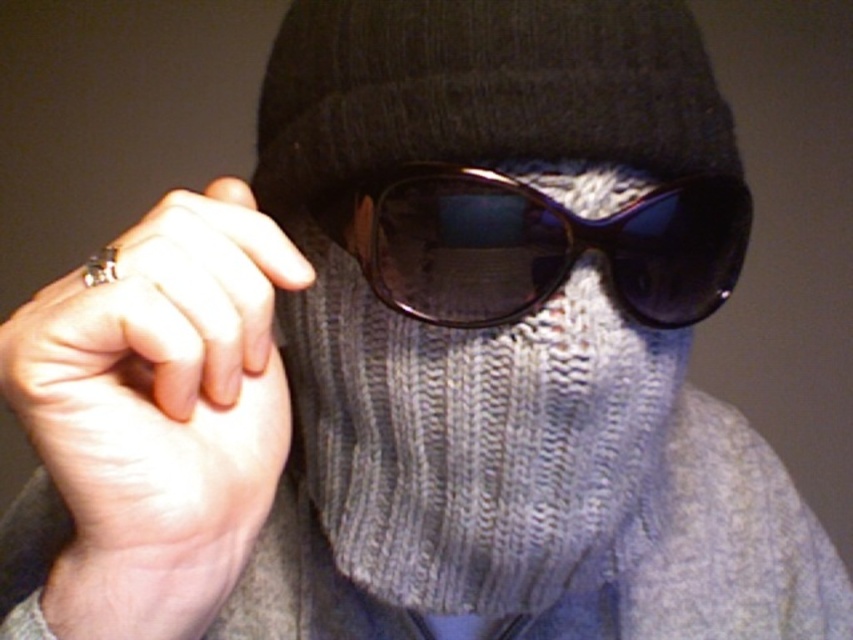
Can you confirm if silver metallic ring at left is taller than sunglasses at center?

Correct, silver metallic ring at left is much taller as sunglasses at center.

Does point (166, 225) come farther from viewer compared to point (669, 202)?

No, it is in front of (669, 202).

Which is in front, point (239, 544) or point (357, 259)?

Point (239, 544) is in front.

This screenshot has width=853, height=640. In order to click on silver metallic ring at left in this screenshot , I will do pyautogui.click(x=161, y=381).

You are a GUI agent. You are given a task and a screenshot of the screen. Output one action in this format:
    pyautogui.click(x=<x>, y=<y>)
    Task: Click on the knitted gray scarf at center
    The image size is (853, 640).
    Given the screenshot: What is the action you would take?
    pyautogui.click(x=474, y=436)

Does point (572, 576) come closer to viewer compared to point (264, 332)?

No, (572, 576) is further to viewer.

Describe the element at coordinates (474, 436) in the screenshot. I see `knitted gray scarf at center` at that location.

Where is `knitted gray scarf at center`? knitted gray scarf at center is located at coordinates (474, 436).

Looking at this image, does knitted gray scarf at center appear on the right side of sunglasses at center?

Incorrect, knitted gray scarf at center is not on the right side of sunglasses at center.

Who is positioned more to the left, knitted gray scarf at center or sunglasses at center?

knitted gray scarf at center is more to the left.

Describe the element at coordinates (474, 436) in the screenshot. The image size is (853, 640). I see `knitted gray scarf at center` at that location.

Identify the location of knitted gray scarf at center. (474, 436).